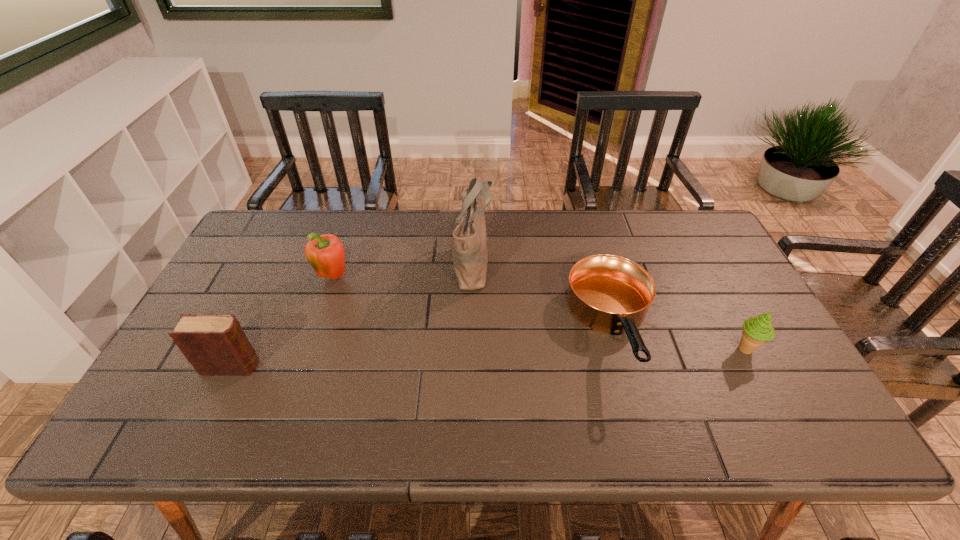
Find the location of a particular element. This screenshot has height=540, width=960. vacant space that satisfies the following two spatial constraints: 1. on the front side of the rightmost object; 2. on the left side of the fourth object from right to left is located at coordinates (309, 349).

Image resolution: width=960 pixels, height=540 pixels. I want to click on free space that satisfies the following two spatial constraints: 1. on the front side of the second object from left to right; 2. on the spine side of the leftmost object, so click(303, 366).

Where is `vacant space that satisfies the following two spatial constraints: 1. on the handle side of the second object from right to left; 2. on the left side of the icecream`? The height and width of the screenshot is (540, 960). vacant space that satisfies the following two spatial constraints: 1. on the handle side of the second object from right to left; 2. on the left side of the icecream is located at coordinates (618, 349).

Where is `free space that satisfies the following two spatial constraints: 1. on the front-facing side of the third object from right to left; 2. on the left side of the icecream`? The height and width of the screenshot is (540, 960). free space that satisfies the following two spatial constraints: 1. on the front-facing side of the third object from right to left; 2. on the left side of the icecream is located at coordinates (471, 349).

Where is `vacant space that satisfies the following two spatial constraints: 1. on the handle side of the icecream; 2. on the right side of the frying pan`? The height and width of the screenshot is (540, 960). vacant space that satisfies the following two spatial constraints: 1. on the handle side of the icecream; 2. on the right side of the frying pan is located at coordinates (618, 349).